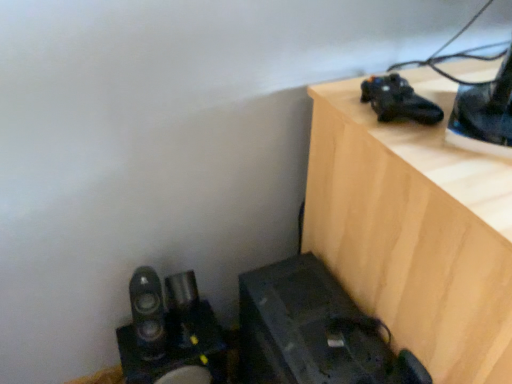
Question: From a real-world perspective, relative to black matte shoe at upper right, is wooden table at upper right vertically above or below?

Choices:
 (A) below
 (B) above

Answer: (A)

Question: In terms of size, does wooden table at upper right appear bigger or smaller than black matte shoe at upper right?

Choices:
 (A) big
 (B) small

Answer: (A)

Question: Considering the real-world distances, which object is closest to the black matte shoe at upper right?

Choices:
 (A) wooden table at upper right
 (B) satin black speakers at lower left

Answer: (A)

Question: Based on their relative distances, which object is farther from the black matte shoe at upper right?

Choices:
 (A) satin black speakers at lower left
 (B) wooden table at upper right

Answer: (A)